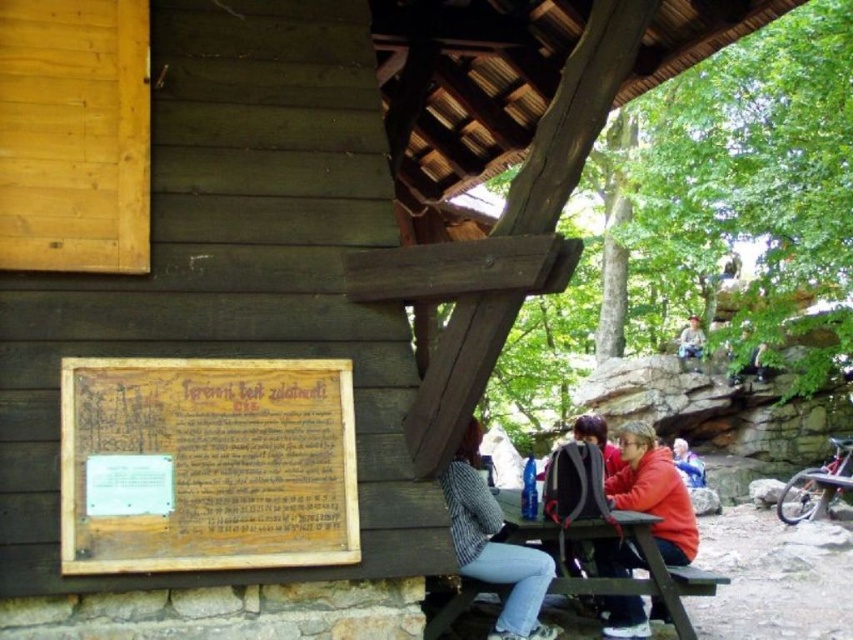
Question: Can you confirm if striped fabric jacket at center is wider than wooden picnic table at center?

Choices:
 (A) no
 (B) yes

Answer: (A)

Question: Which of the following is the farthest from the observer?

Choices:
 (A) blue denim jacket at lower right
 (B) red fleece jacket at lower center
 (C) wooden picnic table at center

Answer: (A)

Question: Which point is closer to the camera taking this photo?

Choices:
 (A) tap(515, 630)
 (B) tap(625, 460)

Answer: (A)

Question: Can you confirm if striped fabric jacket at center is positioned to the left of wooden picnic table at center?

Choices:
 (A) yes
 (B) no

Answer: (A)

Question: Does wooden sign at left have a lesser width compared to striped fabric jacket at center?

Choices:
 (A) yes
 (B) no

Answer: (B)

Question: Which point is farther to the camera?

Choices:
 (A) striped fabric jacket at center
 (B) brown wooden bench at lower center

Answer: (B)